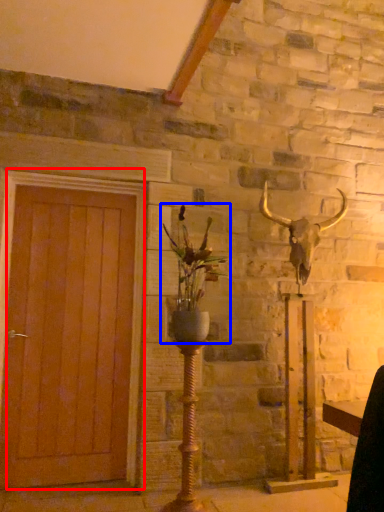
Question: Which object is closer to the camera taking this photo, door (highlighted by a red box) or houseplant (highlighted by a blue box)?

Choices:
 (A) door
 (B) houseplant

Answer: (B)